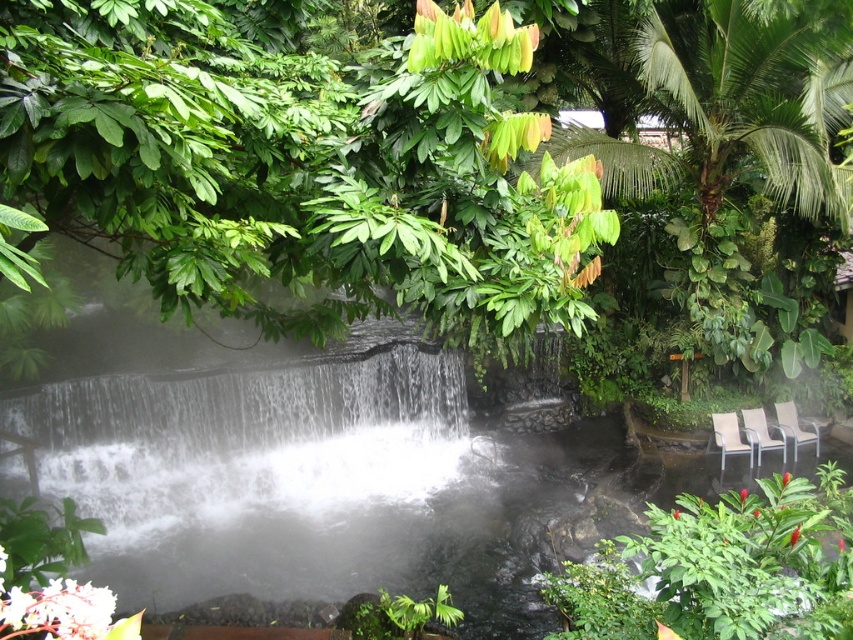
You are sitting in the tropical garden and want to move closer to the waterfall. Which chair, the brown woven chair at lower right or the metallic silver chair at lower right, is closer to you?

The brown woven chair at lower right is closer to you because it is in front of the metallic silver chair at lower right.

You are standing in the tropical setting and see a point marked at coordinates (293, 168). What object is located at that point?

The point at coordinates (293, 168) indicates a green leafy tree at upper center.

You are a visitor at this tropical garden and want to sit down near the waterfall. There are two chairs available. Which chair can you sit on without moving the other one? The metallic silver chair at lower right or the white plastic chair at lower right?

Both the metallic silver chair at lower right and the white plastic chair at lower right are 14.77 inches apart, so you can sit on either chair without moving the other one as there is enough space between them.